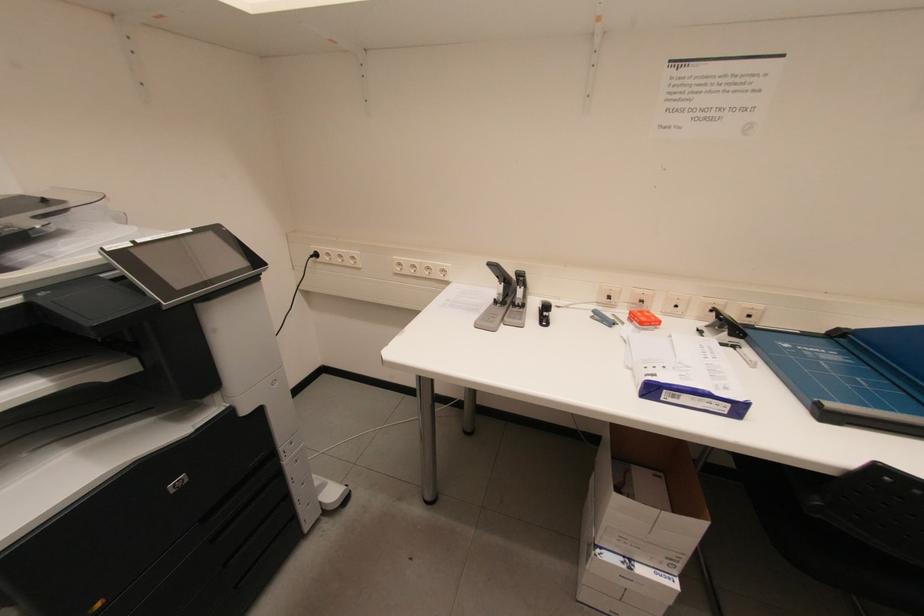
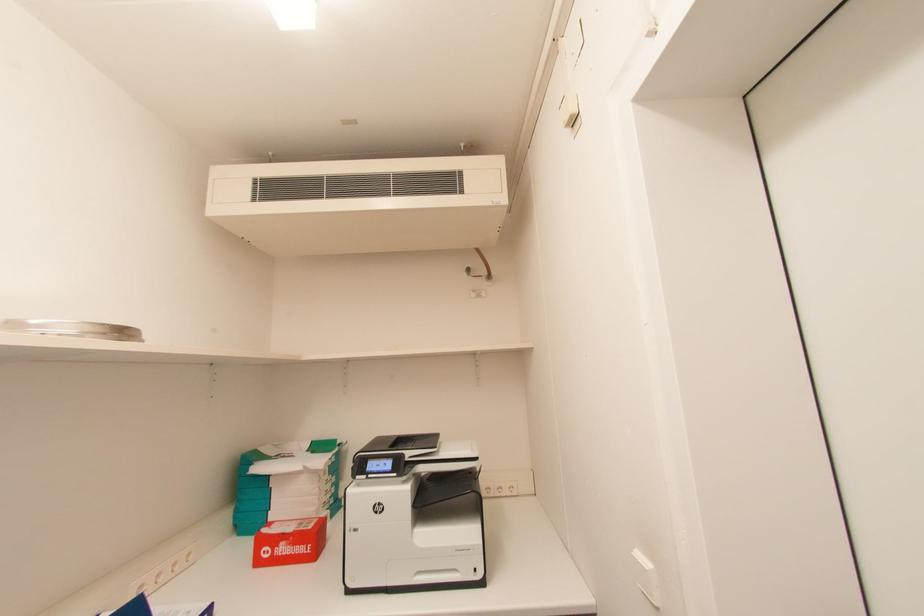
Question: The camera is either moving clockwise (left) or counter-clockwise (right) around the object. The first image is from the beginning of the video and the second image is from the end. Is the camera moving left or right when shooting the video?

Choices:
 (A) Left
 (B) Right

Answer: (A)